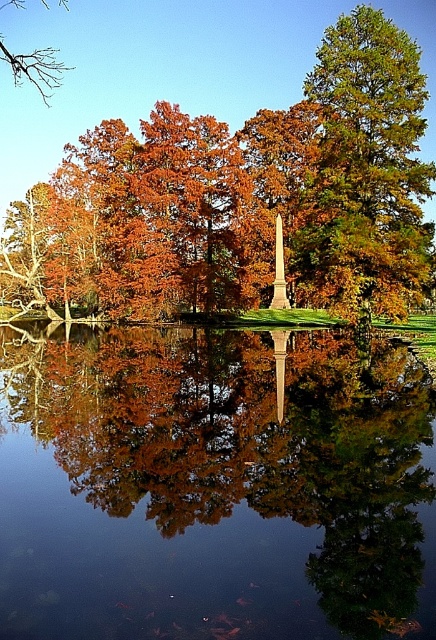
Question: In this image, where is transparent glass lake at center located relative to green glossy tree at upper right?

Choices:
 (A) above
 (B) below

Answer: (B)

Question: Which point is farther to the camera?

Choices:
 (A) (340, 99)
 (B) (6, 61)
 (C) (68, 420)

Answer: (B)

Question: Does green glossy tree at upper right appear on the right side of bare branch at upper left?

Choices:
 (A) yes
 (B) no

Answer: (A)

Question: Which point appears farthest from the camera in this image?

Choices:
 (A) (433, 179)
 (B) (51, 49)

Answer: (B)

Question: Is green glossy tree at upper right above polished stone obelisk at center?

Choices:
 (A) yes
 (B) no

Answer: (A)

Question: Which of the following is the closest to the observer?

Choices:
 (A) bare branch at upper left
 (B) polished stone obelisk at center
 (C) green glossy tree at upper right
 (D) transparent glass lake at center

Answer: (D)